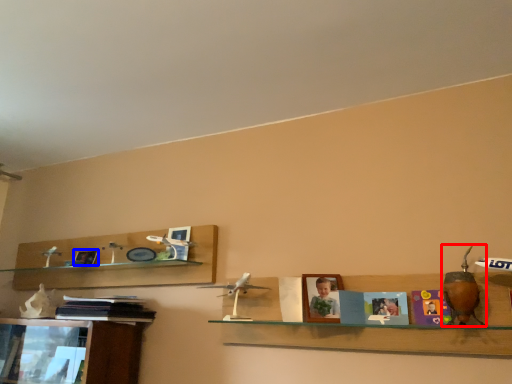
Question: Which point is further to the camera, toy (highlighted by a red box) or picture frame (highlighted by a blue box)?

Choices:
 (A) toy
 (B) picture frame

Answer: (B)